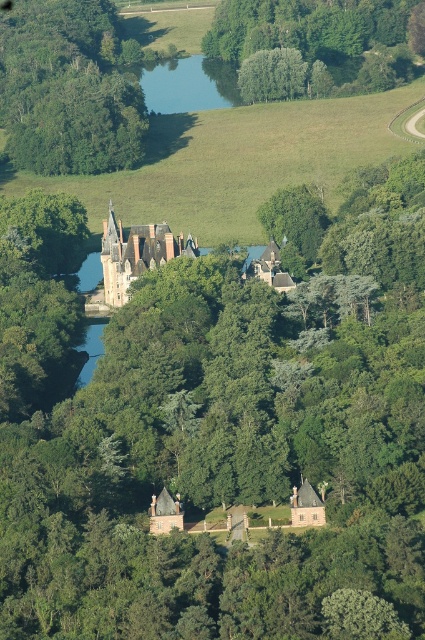
Question: Among these points, which one is farthest from the camera?

Choices:
 (A) (371, 0)
 (B) (305, 508)
 (C) (105, 227)

Answer: (A)

Question: Estimate the real-world distances between objects in this image. Which object is farther from the brown stone castle at center?

Choices:
 (A) blue reflective water at center
 (B) green leafy tree at upper left
 (C) green leafy tree at upper center

Answer: (A)

Question: Can you confirm if brown stone castle at center is bigger than brown wooden house at center?

Choices:
 (A) yes
 (B) no

Answer: (A)

Question: Which of these objects is positioned closest to the blue reflective water at center?

Choices:
 (A) brown wooden house at center
 (B) green leafy tree at upper left
 (C) brown stone castle at center

Answer: (B)

Question: Is green leafy tree at upper center below brown wooden house at center?

Choices:
 (A) yes
 (B) no

Answer: (B)

Question: Observing the image, what is the correct spatial positioning of green leafy tree at upper center in reference to brown wooden house at center?

Choices:
 (A) below
 (B) above

Answer: (B)